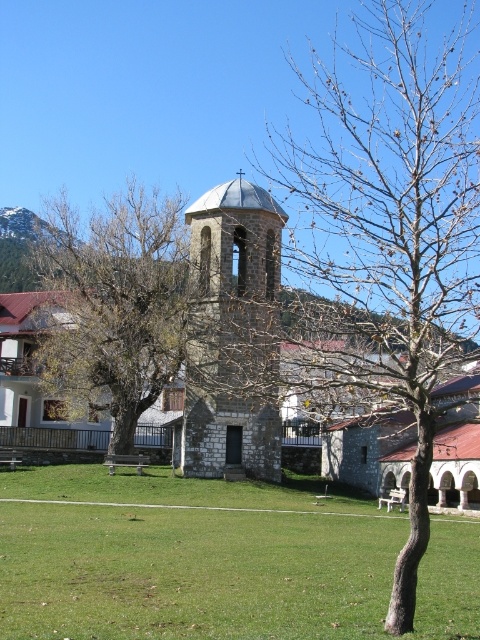
Question: Can you confirm if bare branches at center is positioned below stone bell tower at center?

Choices:
 (A) yes
 (B) no

Answer: (B)

Question: Is green grass at center thinner than stone bell tower at center?

Choices:
 (A) yes
 (B) no

Answer: (B)

Question: Does green grass at center appear under brown leafy tree at center?

Choices:
 (A) yes
 (B) no

Answer: (A)

Question: Which of the following is the closest to the observer?

Choices:
 (A) (444, 545)
 (B) (82, 369)
 (C) (336, 224)
 (D) (232, 390)

Answer: (A)

Question: Which point is farther to the camera?

Choices:
 (A) (384, 90)
 (B) (145, 364)
 (C) (269, 426)
 (D) (370, 614)

Answer: (A)

Question: Based on their relative distances, which object is nearer to the green grass at center?

Choices:
 (A) brown leafy tree at center
 (B) bare branches at center

Answer: (A)